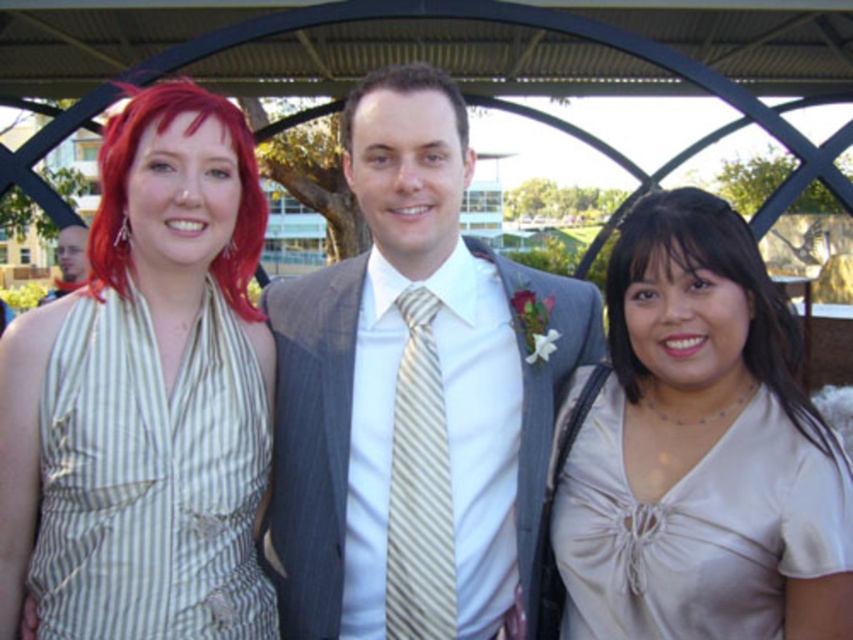
You are a photographer at a formal event. You need to adjust the camera settings to ensure both the satin beige blouse at right and the brown matte hair at center are in focus. Considering their sizes, which object should you prioritize focusing on first to ensure clarity?

The satin beige blouse at right has a smaller size compared to brown matte hair at center, so you should prioritize focusing on the brown matte hair at center first as it is larger and may require more precise focus to capture details.

You are a photographer at a formal event. You need to position yourself so that you can capture both the satin beige blouse at right and the green striped fabric dress at left in the same frame. Based on their positions, which direction should you face to include both in your shot?

You should face towards the center between the satin beige blouse at right and the green striped fabric dress at left to include both in your shot since the satin beige blouse at right is positioned to the right of the green striped fabric dress at left.

You are a photographer at a wedding venue and need to capture a closeup shot of the green striped fabric dress at left. Based on the scene, is the dress within a 10 meter range from the camera to ensure clear focus?

The green striped fabric dress at left is 20.04 meters from camera, which is beyond the 10 meter range required for clear focus. Move closer or adjust camera settings for better results.